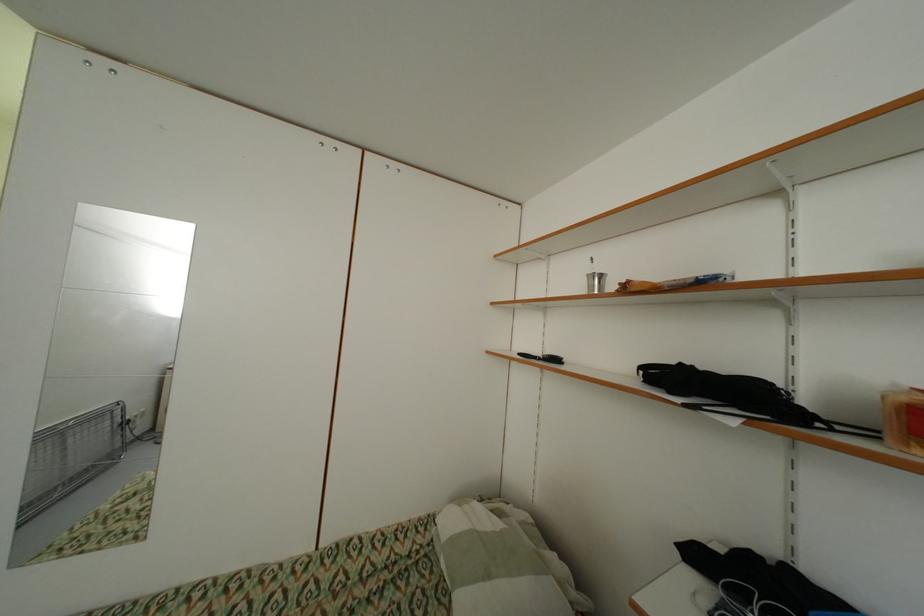
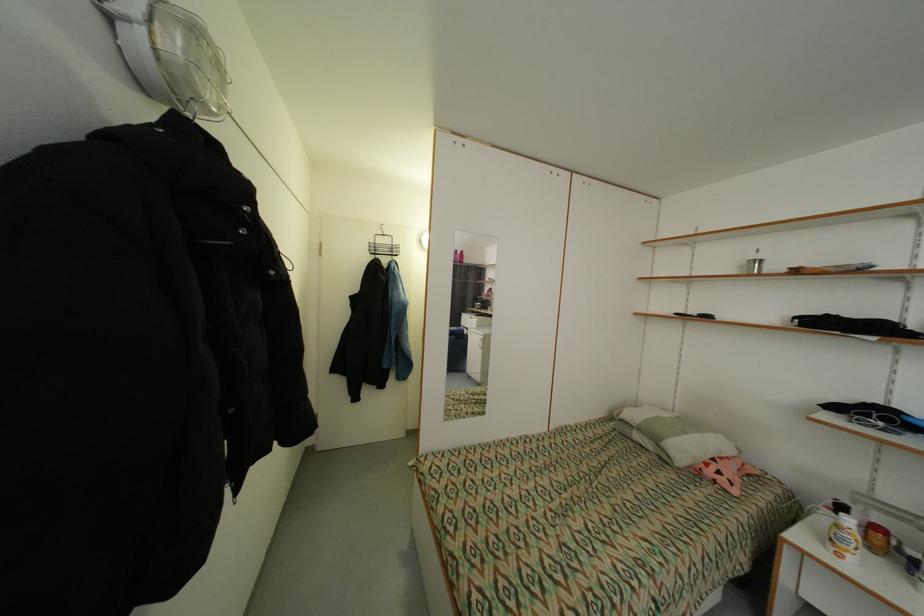
The images are taken continuously from a first-person perspective. In which direction are you moving?

The movement direction of the cameraman is left, backward.